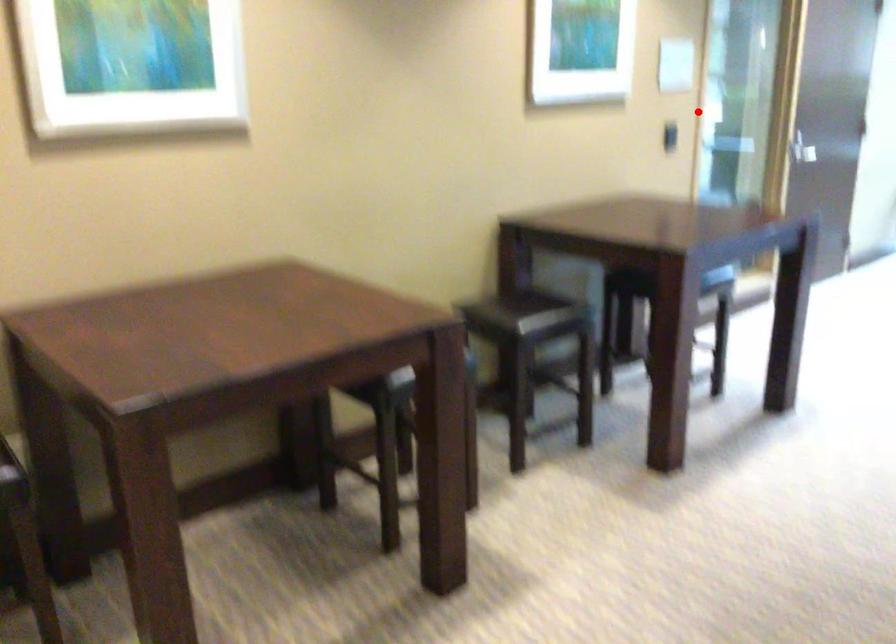
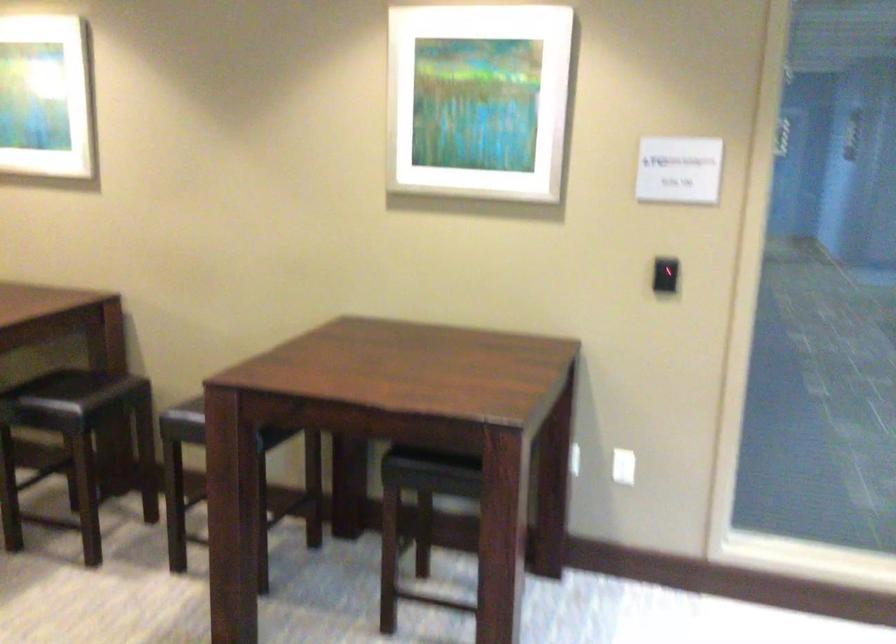
Find the pixel in the second image that matches the highlighted location in the first image.

(665, 275)